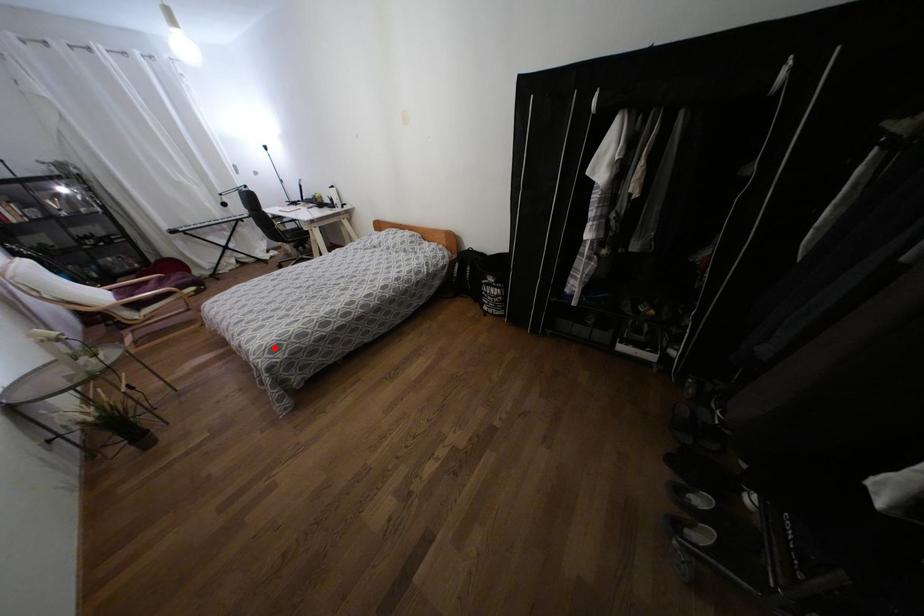
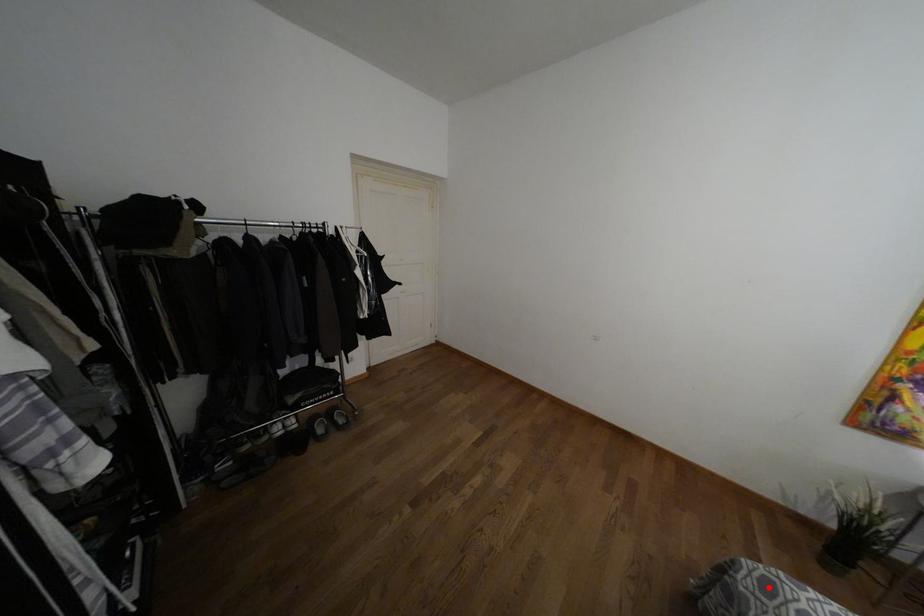
I am providing you with two images of the same scene from different viewpoints. A red point is marked on the first image and another point is marked on the second image. Does the point marked in image1 correspond to the same location as the one in image2?

Yes